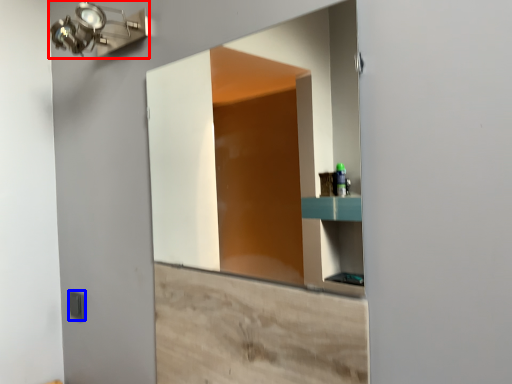
Question: Which object appears farthest to the camera in this image, light fixture (highlighted by a red box) or light switch (highlighted by a blue box)?

Choices:
 (A) light fixture
 (B) light switch

Answer: (B)